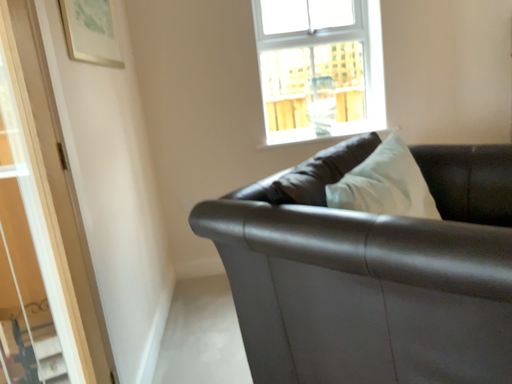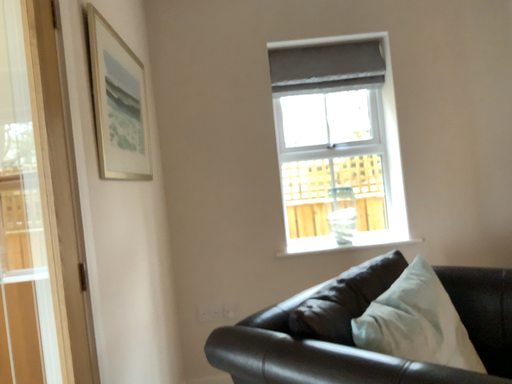
Question: How did the camera likely rotate when shooting the video?

Choices:
 (A) rotated upward
 (B) rotated downward

Answer: (A)